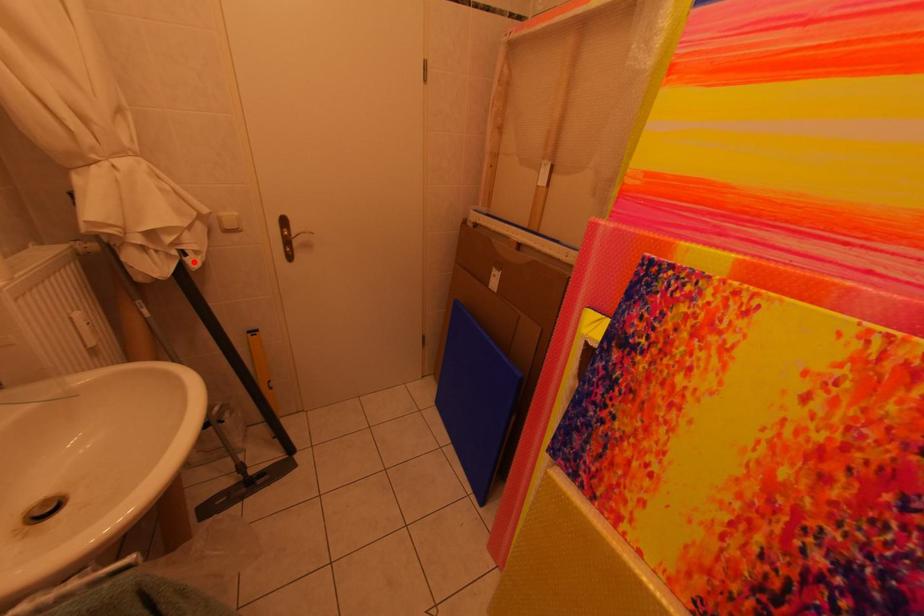
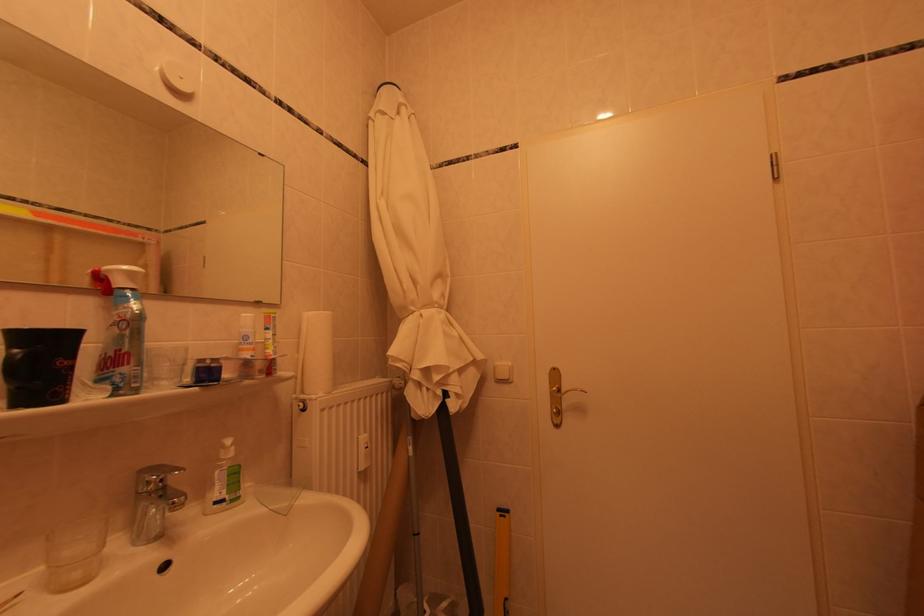
Where in the second image is the point corresponding to the highlighted location from the first image?

(456, 405)